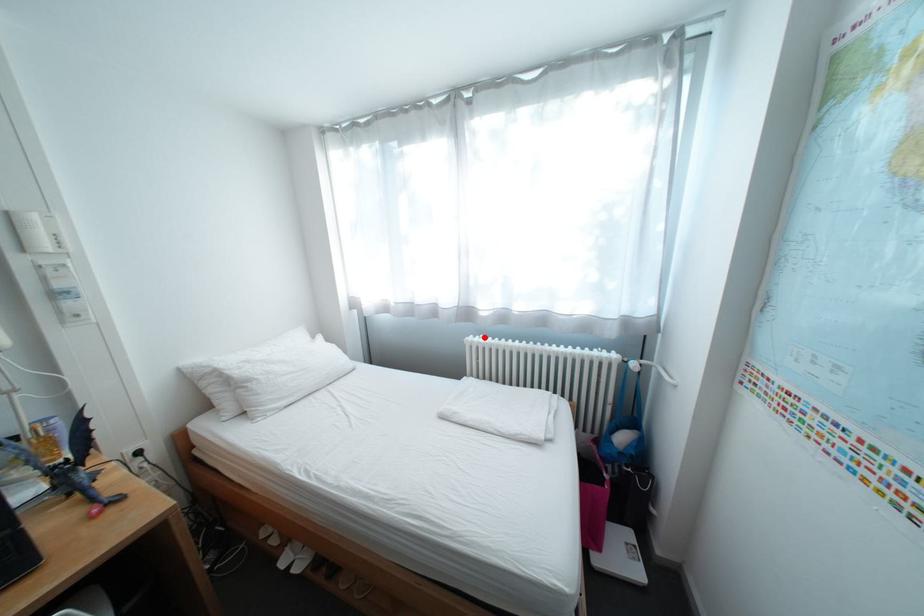
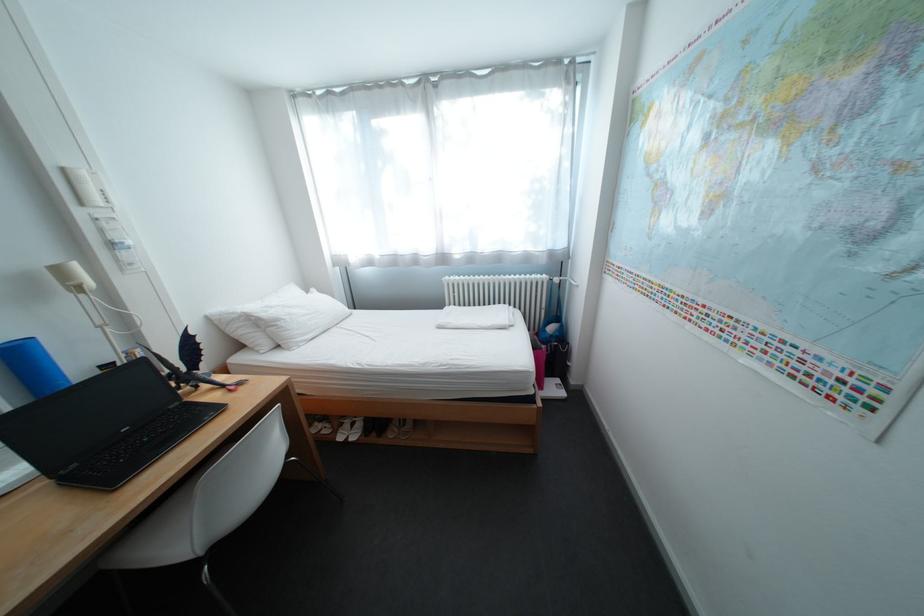
Where in the second image is the point corresponding to the highlighted location from the first image?

(459, 278)